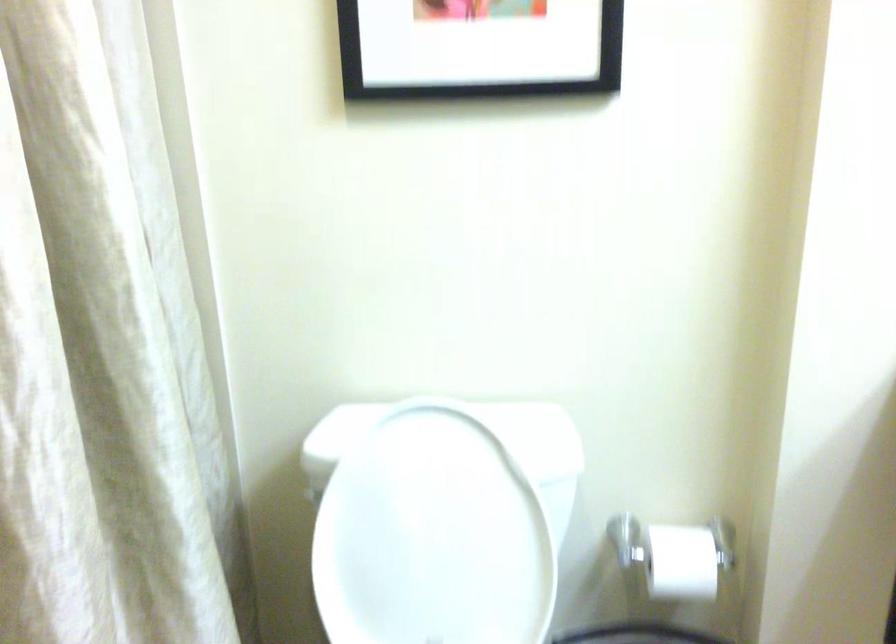
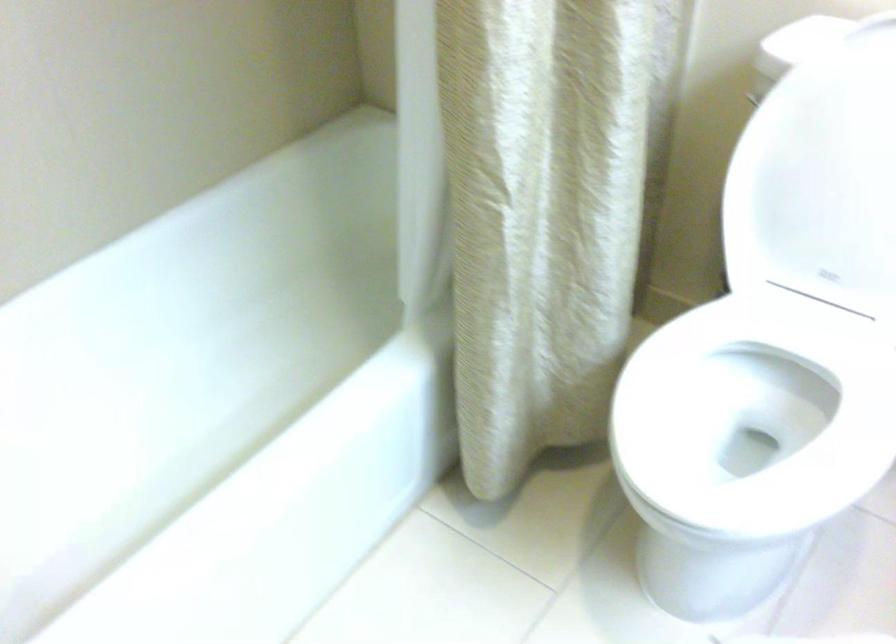
Find the pixel in the second image that matches (x=398, y=556) in the first image.

(821, 178)